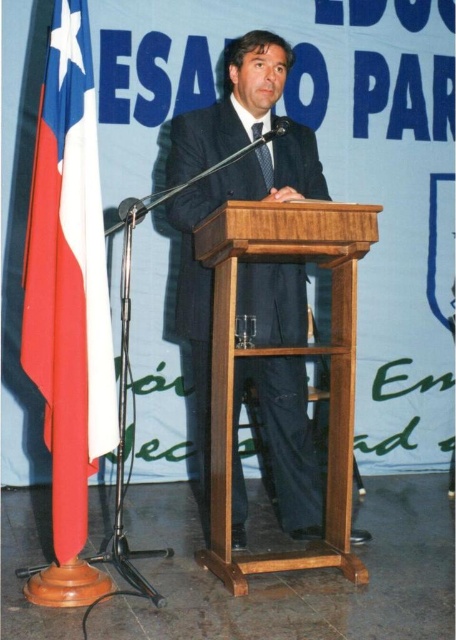
Is red fabric flag at left positioned at the back of black silk tie at center?

No, it is not.

Between red fabric flag at left and black silk tie at center, which one is positioned lower?

red fabric flag at left

Locate an element on the screen. Image resolution: width=456 pixels, height=640 pixels. red fabric flag at left is located at coordinates (68, 280).

Describe the element at coordinates (207, 268) in the screenshot. I see `dark blue suit at center` at that location.

Does dark blue suit at center appear on the left side of black silk tie at center?

Correct, you'll find dark blue suit at center to the left of black silk tie at center.

Measure the distance between dark blue suit at center and camera.

dark blue suit at center and camera are 8.08 feet apart.

Identify the location of dark blue suit at center. The height and width of the screenshot is (640, 456). click(x=207, y=268).

Is dark blue suit at center behind red fabric flag at left?

Yes, it is.

Is point (310, 532) behind point (63, 358)?

Yes, point (310, 532) is farther from viewer.

This screenshot has width=456, height=640. Find the location of `dark blue suit at center`. dark blue suit at center is located at coordinates (207, 268).